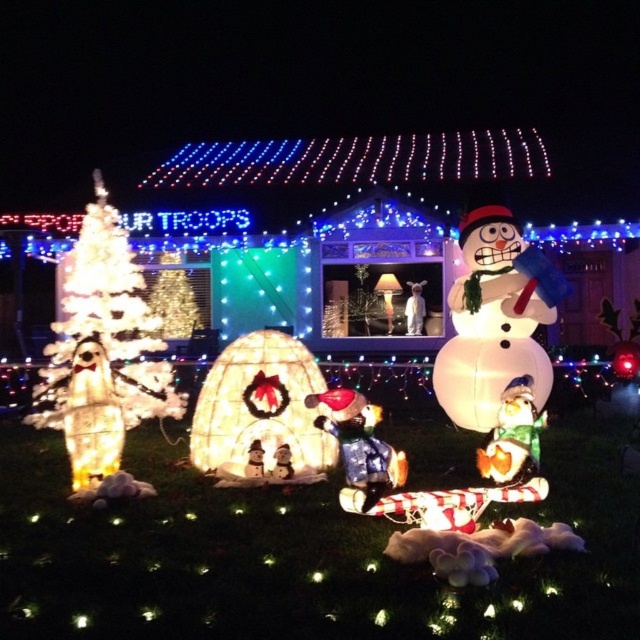
You are planning to place a new decoration between the inflatable white snowman at right and the shiny blue snowman at center. Considering their widths, which snowman should the decoration be closer to to ensure it fits better?

The inflatable white snowman at right is wider than the shiny blue snowman at center. Therefore, the decoration should be placed closer to the shiny blue snowman at center to accommodate the space better.

Based on the photo, you are standing in front of the festive Christmas display and want to know which of the two points, point (372,465) or point (515,403), is closer to you. Can you determine this based on the scene?

Point (372,465) is closer to the viewer than point (515,403), so it is the closer one.

You are planning to place a new decoration between the inflatable white snowman at right and the shiny metallic snowman at center. Considering their sizes, which one should you place the decoration closer to to ensure it doesn

The inflatable white snowman at right is larger in size than the shiny metallic snowman at center, so placing the decoration closer to the inflatable white snowman at right would balance the visual impact between the two snowmen.